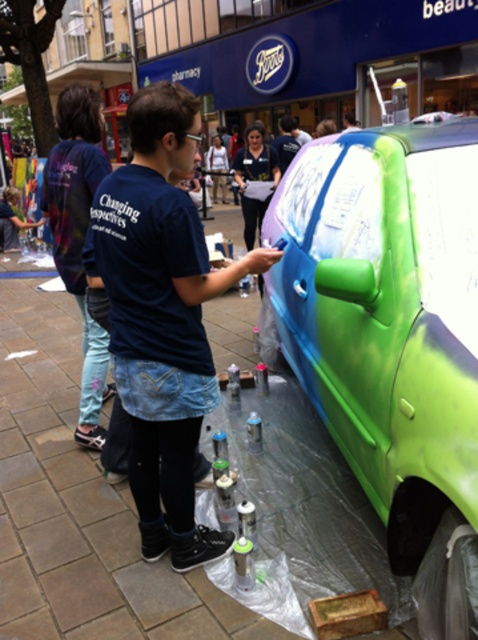
What is the exact coordinate of the shiny metallic car at center?

The shiny metallic car at center is located at point (392,337).

You are standing at the center of the image. There is a point at coordinate (x=392, y=337). What object is this point located on?

The point at coordinate (x=392, y=337) is located on the shiny metallic car at center.